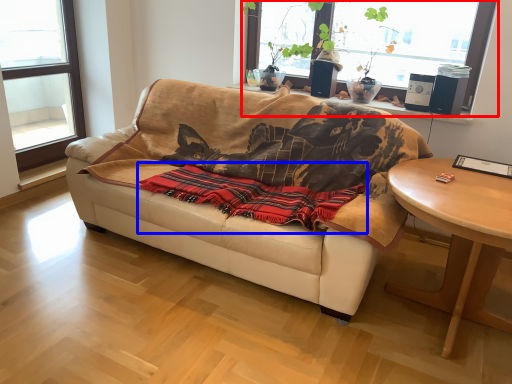
Question: Which object is further to the camera taking this photo, window (highlighted by a red box) or blanket (highlighted by a blue box)?

Choices:
 (A) window
 (B) blanket

Answer: (A)